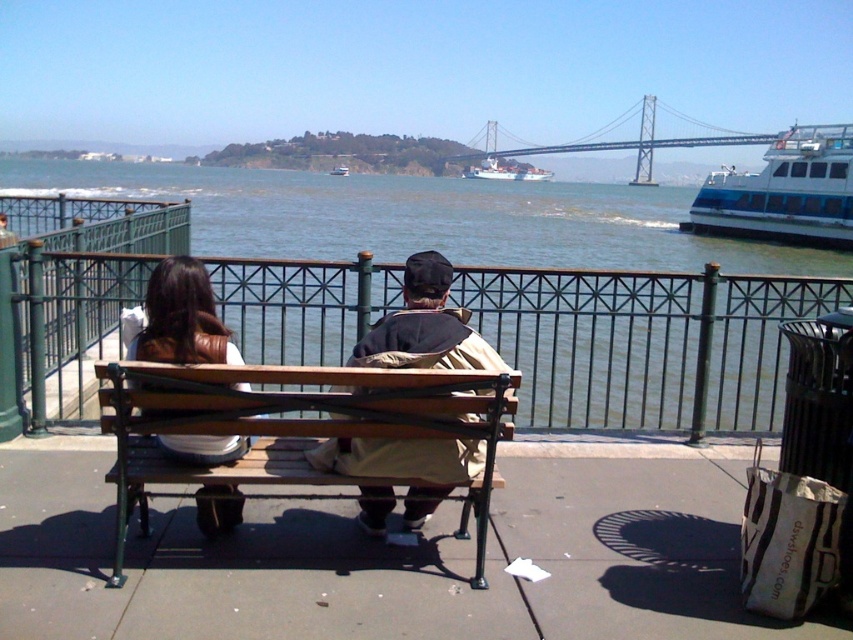
You are a photographer standing on the paved surface near the bench. You want to take a photo that includes both the clear water at bench right and the white glossy cruise ship at upper right. Based on their positions, which object is closer to you?

The clear water at bench right is closer to you because it is positioned at the bench right, which is part of the foreground area where the individuals are seated, whereas the white glossy cruise ship at upper right is located further away in the upper right section of the image.

You are a photographer trying to capture a closeup shot of both the tan fabric jacket at center and the leather jacket at center. Since you want to ensure both jackets are fully visible in the frame, which jacket requires you to adjust your camera angle to accommodate its width?

The tan fabric jacket at center might be wider than the leather jacket at center, so you should adjust your camera angle to accommodate the width of the tan fabric jacket at center to ensure it fits in the frame.

You are a photographer standing at the edge of the waterfront. You want to take a photo of the clear water at bench right and the leather jacket at center in the same frame. Your camera has a maximum zoom range that can capture objects up to 30 meters apart. Will you be able to include both subjects in a single photo without moving?

The clear water at bench right and the leather jacket at center are 31.41 meters apart from each other. Since the maximum zoom can only capture up to 30 meters, you won need to move closer to include both subjects in the frame.